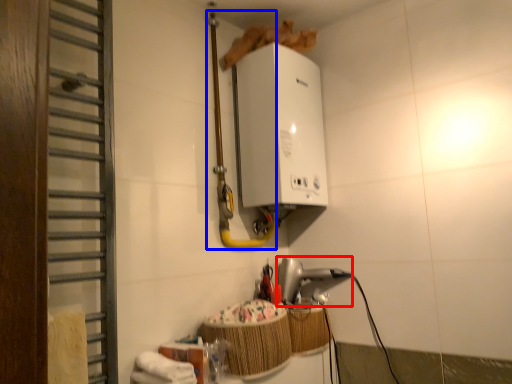
Question: Which object is further to the camera taking this photo, appliance (highlighted by a red box) or pipe (highlighted by a blue box)?

Choices:
 (A) appliance
 (B) pipe

Answer: (A)